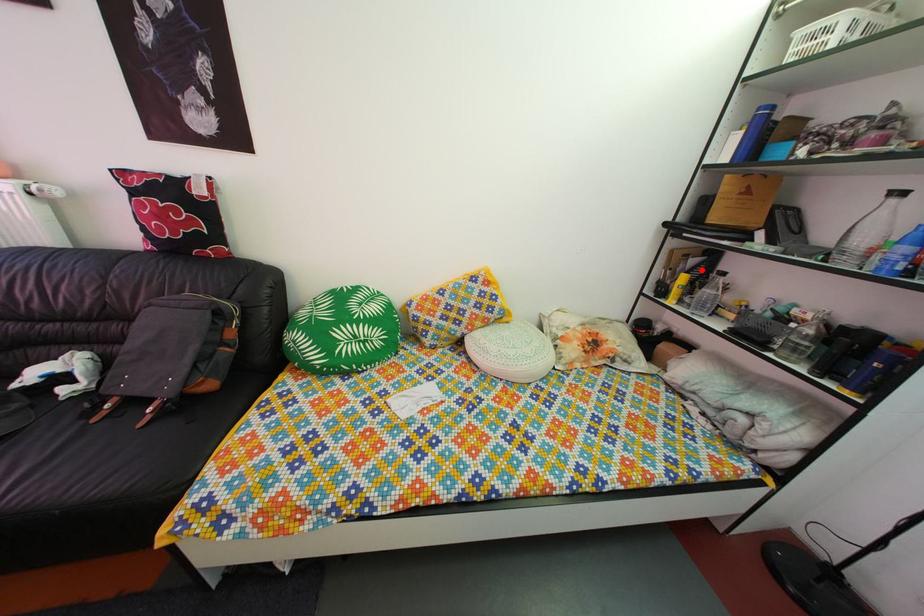
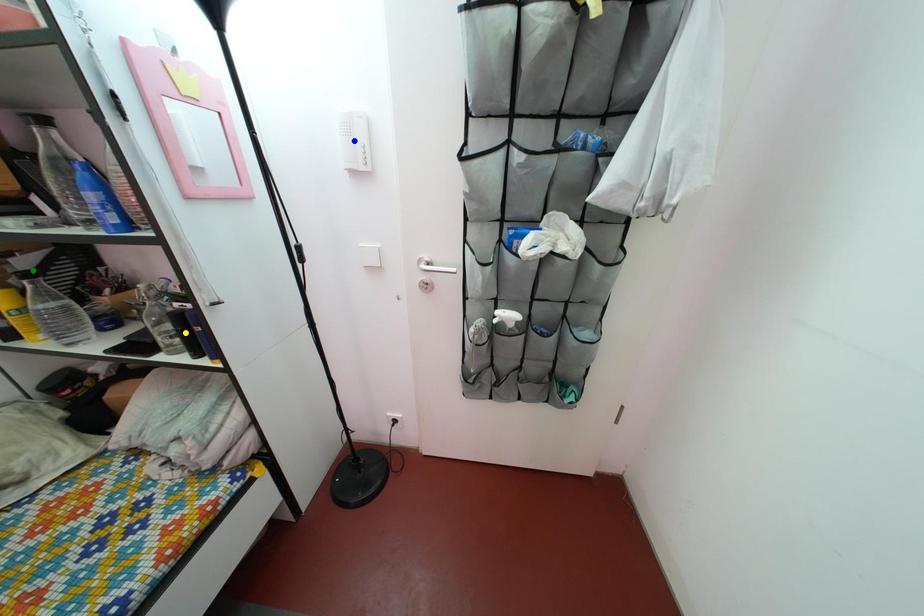
Question: I am providing you with two images of the same scene from different viewpoints. A red point is marked on the first image. You are given multiple points on the second image. Which spot in image 2 lines up with the point in image 1?

Choices:
 (A) blue point
 (B) green point
 (C) yellow point

Answer: (B)